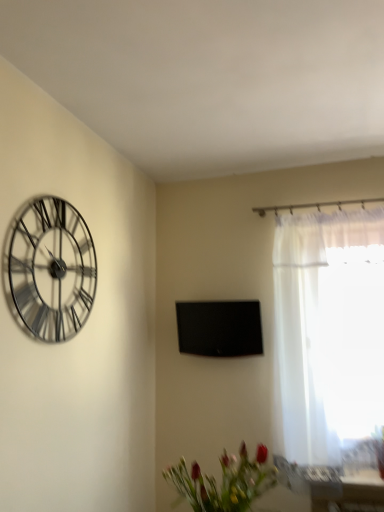
Question: Considering the relative sizes of metallic silver clock at upper left and black glossy tv at center in the image provided, is metallic silver clock at upper left smaller than black glossy tv at center?

Choices:
 (A) yes
 (B) no

Answer: (A)

Question: Are metallic silver clock at upper left and black glossy tv at center far apart?

Choices:
 (A) yes
 (B) no

Answer: (A)

Question: Considering the relative sizes of metallic silver clock at upper left and black glossy tv at center in the image provided, is metallic silver clock at upper left shorter than black glossy tv at center?

Choices:
 (A) no
 (B) yes

Answer: (A)

Question: From a real-world perspective, does metallic silver clock at upper left sit lower than black glossy tv at center?

Choices:
 (A) no
 (B) yes

Answer: (A)

Question: Does metallic silver clock at upper left have a greater height compared to black glossy tv at center?

Choices:
 (A) yes
 (B) no

Answer: (A)

Question: In terms of height, does black glossy tv at center look taller or shorter compared to white sheer curtain at right?

Choices:
 (A) short
 (B) tall

Answer: (A)

Question: Relative to white sheer curtain at right, is black glossy tv at center in front or behind?

Choices:
 (A) front
 (B) behind

Answer: (B)

Question: From a real-world perspective, is black glossy tv at center above or below white sheer curtain at right?

Choices:
 (A) above
 (B) below

Answer: (A)

Question: Considering the relative positions of black glossy tv at center and white sheer curtain at right in the image provided, is black glossy tv at center to the left or to the right of white sheer curtain at right?

Choices:
 (A) left
 (B) right

Answer: (A)

Question: Considering their positions, is matte green vase at lower center located in front of or behind white sheer curtain at right?

Choices:
 (A) front
 (B) behind

Answer: (A)

Question: From the image's perspective, relative to white sheer curtain at right, is matte green vase at lower center above or below?

Choices:
 (A) below
 (B) above

Answer: (A)

Question: From a real-world perspective, is matte green vase at lower center physically located above or below white sheer curtain at right?

Choices:
 (A) above
 (B) below

Answer: (B)

Question: Is matte green vase at lower center inside or outside of white sheer curtain at right?

Choices:
 (A) inside
 (B) outside

Answer: (B)

Question: From a real-world perspective, is metallic silver clock at upper left physically located above or below black glossy tv at center?

Choices:
 (A) above
 (B) below

Answer: (A)

Question: Based on their sizes in the image, would you say metallic silver clock at upper left is bigger or smaller than black glossy tv at center?

Choices:
 (A) small
 (B) big

Answer: (A)